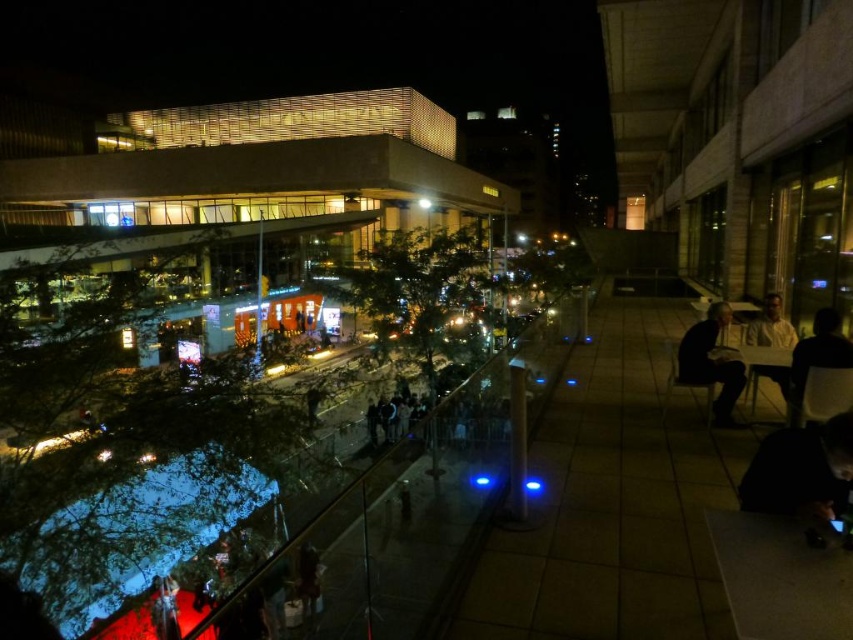
Question: Which of the following is the closest to the observer?

Choices:
 (A) dark brown leather chair at right
 (B) white matte shirt at right

Answer: (A)

Question: From the image, what is the correct spatial relationship of dark fabric bag at lower right in relation to white matte shirt at right?

Choices:
 (A) left
 (B) right

Answer: (A)

Question: Does matte glass building at center appear on the left side of dark brown leather chair at right?

Choices:
 (A) no
 (B) yes

Answer: (B)

Question: Does dark gray fabric jacket at right appear under white matte shirt at right?

Choices:
 (A) yes
 (B) no

Answer: (A)

Question: Based on their relative distances, which object is farther from the dark gray fabric jacket at right?

Choices:
 (A) matte glass building at center
 (B) white matte shirt at right

Answer: (A)

Question: Estimate the real-world distances between objects in this image. Which object is farther from the dark gray fabric jacket at right?

Choices:
 (A) dark brown leather chair at right
 (B) dark fabric bag at lower right

Answer: (B)